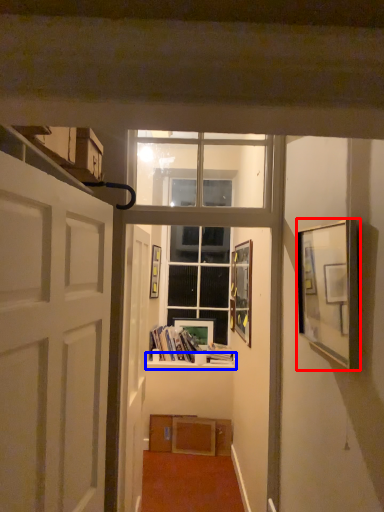
Question: Which of the following is the farthest to the observer, picture frame (highlighted by a red box) or window sill (highlighted by a blue box)?

Choices:
 (A) picture frame
 (B) window sill

Answer: (B)